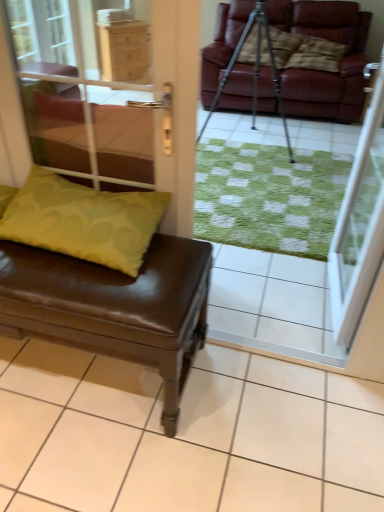
Question: Can you confirm if brown leather bench at lower left is bigger than metallic tripod at center?

Choices:
 (A) yes
 (B) no

Answer: (B)

Question: From a real-world perspective, is brown leather bench at lower left located beneath metallic tripod at center?

Choices:
 (A) yes
 (B) no

Answer: (A)

Question: Could metallic tripod at center be considered to be inside brown leather bench at lower left?

Choices:
 (A) yes
 (B) no

Answer: (B)

Question: From a real-world perspective, is brown leather bench at lower left over metallic tripod at center?

Choices:
 (A) yes
 (B) no

Answer: (B)

Question: Is brown leather bench at lower left smaller than metallic tripod at center?

Choices:
 (A) no
 (B) yes

Answer: (B)

Question: Considering their positions, is green fabric cushion at lower left, the second screen door in the right-to-left sequence, located in front of or behind transparent glass screen door at upper right, arranged as the 1th screen door when viewed from the right?

Choices:
 (A) behind
 (B) front

Answer: (B)

Question: In terms of height, does green fabric cushion at lower left, the second screen door in the right-to-left sequence, look taller or shorter compared to transparent glass screen door at upper right, placed as the 2th screen door when sorted from left to right?

Choices:
 (A) tall
 (B) short

Answer: (B)

Question: Is green fabric cushion at lower left, positioned as the 1th screen door in left-to-right order, inside the boundaries of transparent glass screen door at upper right, arranged as the 1th screen door when viewed from the right, or outside?

Choices:
 (A) outside
 (B) inside

Answer: (A)

Question: Is point (x=96, y=185) closer or farther from the camera than point (x=354, y=197)?

Choices:
 (A) closer
 (B) farther

Answer: (A)

Question: From the image's perspective, is transparent glass screen door at upper right, arranged as the 1th screen door when viewed from the right, located above or below metallic tripod at center?

Choices:
 (A) above
 (B) below

Answer: (B)

Question: Based on their positions, is transparent glass screen door at upper right, arranged as the 1th screen door when viewed from the right, located to the left or right of metallic tripod at center?

Choices:
 (A) right
 (B) left

Answer: (A)

Question: Considering the positions of transparent glass screen door at upper right, arranged as the 1th screen door when viewed from the right, and metallic tripod at center in the image, is transparent glass screen door at upper right, arranged as the 1th screen door when viewed from the right, taller or shorter than metallic tripod at center?

Choices:
 (A) short
 (B) tall

Answer: (B)

Question: From a real-world perspective, relative to metallic tripod at center, is transparent glass screen door at upper right, arranged as the 1th screen door when viewed from the right, vertically above or below?

Choices:
 (A) above
 (B) below

Answer: (A)

Question: From the image's perspective, relative to brown leather bench at lower left, is green fabric cushion at lower left, the second screen door in the right-to-left sequence, above or below?

Choices:
 (A) below
 (B) above

Answer: (B)

Question: Considering the positions of point (44, 111) and point (82, 315), is point (44, 111) closer or farther from the camera than point (82, 315)?

Choices:
 (A) closer
 (B) farther

Answer: (B)